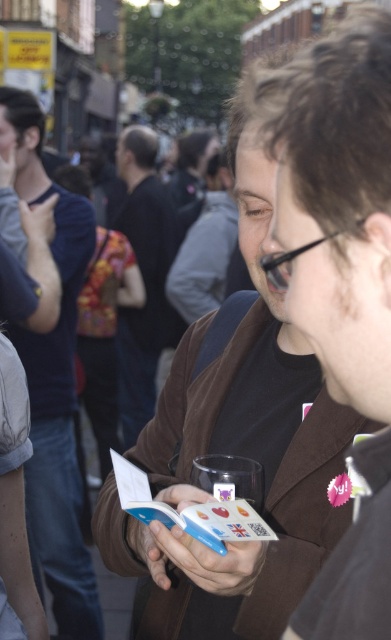
You are at a social event and see the matte brown jacket at left and the floral fabric purse at center. Which object is closer to the left side of the image?

The floral fabric purse at center is closer to the left side of the image because the matte brown jacket at left is to the right of it.

You are at a social event and want to hand a gift to the person wearing the matte brown jacket at left. The gift is slightly larger than the floral fabric purse at center. Can you place the gift in the purse?

The matte brown jacket at left is below the floral fabric purse at center, but the gift is larger than the floral fabric purse at center, so it won let the gift fit inside.